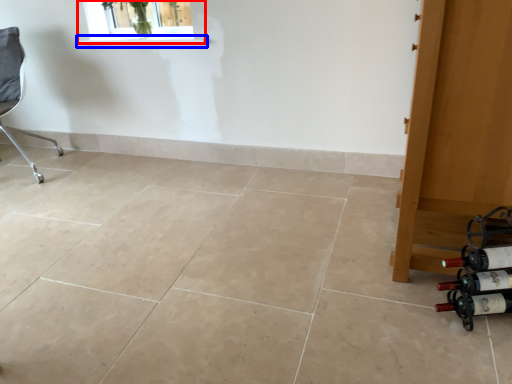
Question: Which object is further to the camera taking this photo, window (highlighted by a red box) or window sill (highlighted by a blue box)?

Choices:
 (A) window
 (B) window sill

Answer: (B)